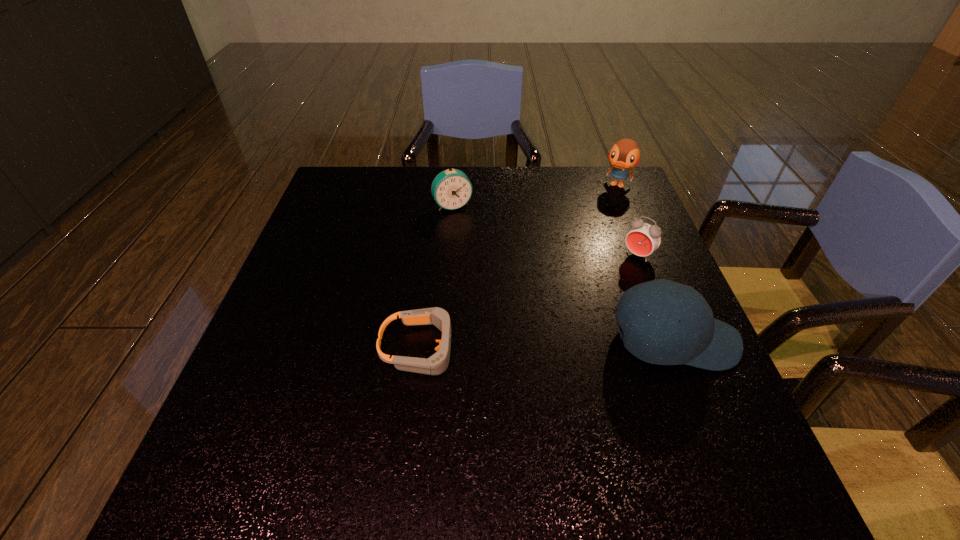
Where is `vacant area located on the face of the right alarm clock`? vacant area located on the face of the right alarm clock is located at coordinates (545, 351).

You are a GUI agent. You are given a task and a screenshot of the screen. Output one action in this format:
    pyautogui.click(x=<x>, y=<y>)
    Task: Click on the blank space located on the front-facing side of the second farthest object
    The width and height of the screenshot is (960, 540).
    Given the screenshot: What is the action you would take?
    pyautogui.click(x=477, y=251)

Where is `vacant space located on the front-facing side of the second farthest object`? Image resolution: width=960 pixels, height=540 pixels. vacant space located on the front-facing side of the second farthest object is located at coordinates 477,251.

Identify the location of blank space located on the front-facing side of the second farthest object. (490, 274).

You are a GUI agent. You are given a task and a screenshot of the screen. Output one action in this format:
    pyautogui.click(x=<x>, y=<y>)
    Task: Click on the vacant region located on the front-facing side of the farthest object
    
    Given the screenshot: What is the action you would take?
    pyautogui.click(x=603, y=219)

Find the location of a particular element. This screenshot has width=960, height=540. vacant position located 0.330m on the front-facing side of the farthest object is located at coordinates (583, 260).

Find the location of a particular element. The height and width of the screenshot is (540, 960). blank space located 0.140m on the front-facing side of the farthest object is located at coordinates (603, 219).

Locate an element on the screen. alarm clock positioned at the far edge is located at coordinates (451, 189).

This screenshot has height=540, width=960. I want to click on duck that is at the far edge, so click(x=625, y=154).

The image size is (960, 540). I want to click on baseball cap present at the right edge, so click(656, 336).